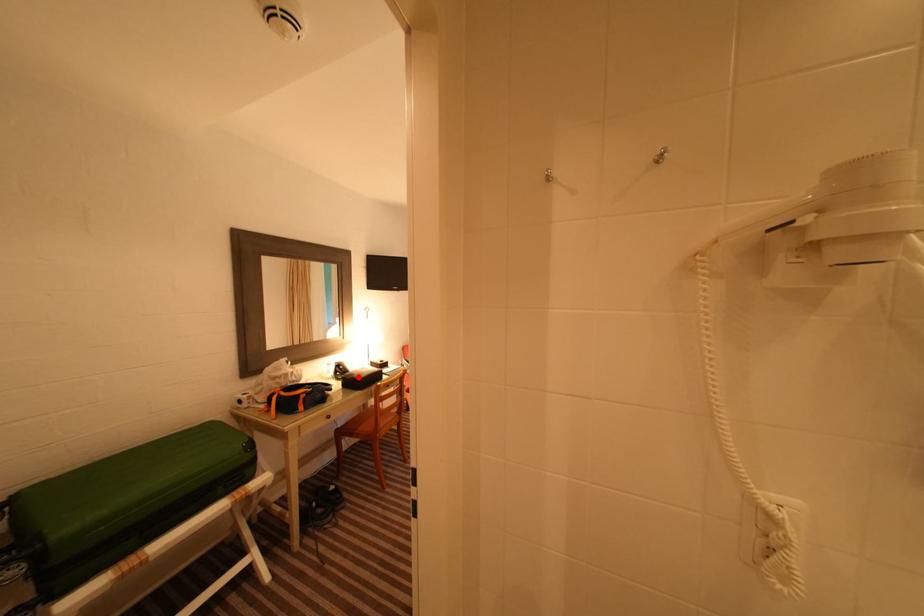
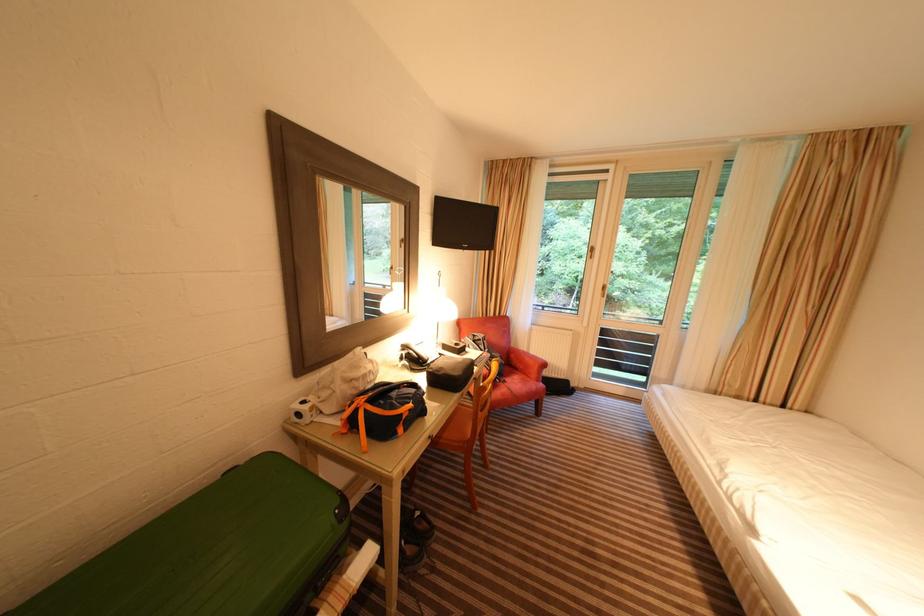
Where in the second image is the point corresponding to the highlighted location from the first image?

(447, 371)